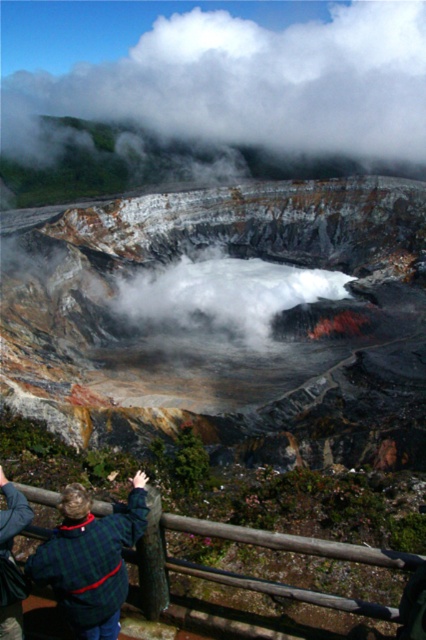
Is white fluffy cloud at upper center wider than green plaid sweater at lower left?

Correct, the width of white fluffy cloud at upper center exceeds that of green plaid sweater at lower left.

Between point (131, 51) and point (74, 484), which one is positioned in front?

Point (74, 484)

Between point (380, 141) and point (80, 515), which one is positioned in front?

Positioned in front is point (80, 515).

You are a GUI agent. You are given a task and a screenshot of the screen. Output one action in this format:
    pyautogui.click(x=<x>, y=<y>)
    Task: Click on the white fluffy cloud at upper center
    
    Given the screenshot: What is the action you would take?
    pyautogui.click(x=250, y=86)

Can you confirm if volcanic rock crater at center is taller than green plaid shirt at lower left?

Indeed, volcanic rock crater at center has a greater height compared to green plaid shirt at lower left.

Between volcanic rock crater at center and green plaid shirt at lower left, which one appears on the left side from the viewer's perspective?

Positioned to the left is green plaid shirt at lower left.

Find the location of a particular element. The width and height of the screenshot is (426, 640). volcanic rock crater at center is located at coordinates (226, 320).

Is brown wooden rail at lower center shorter than green plaid shirt at lower left?

No, brown wooden rail at lower center is not shorter than green plaid shirt at lower left.

Is brown wooden rail at lower center taller than green plaid shirt at lower left?

Indeed, brown wooden rail at lower center has a greater height compared to green plaid shirt at lower left.

Is point (224, 531) less distant than point (3, 630)?

No.

Where is `brown wooden rail at lower center`? This screenshot has width=426, height=640. brown wooden rail at lower center is located at coordinates (250, 544).